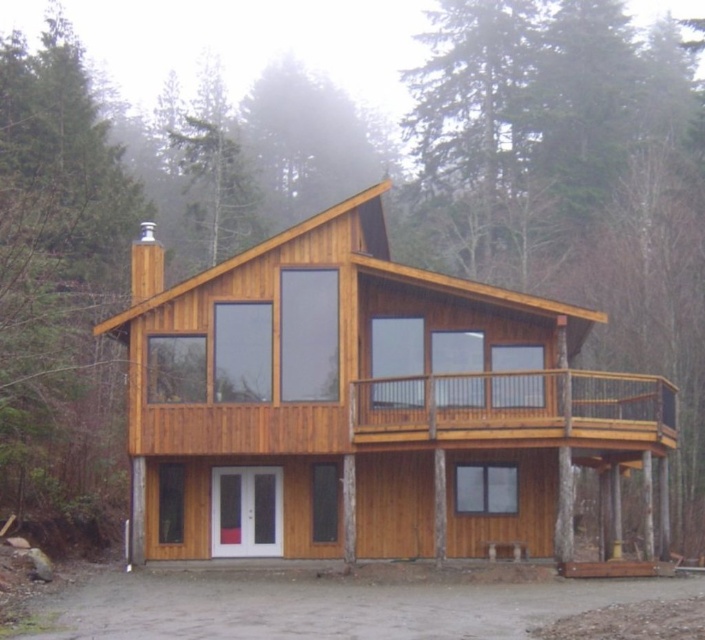
Question: Can you confirm if natural wood log cabin at center is positioned to the right of gray concrete driveway at lower center?

Choices:
 (A) yes
 (B) no

Answer: (A)

Question: Considering the real-world distances, which object is closest to the gray concrete driveway at lower center?

Choices:
 (A) wooden deck at center
 (B) natural wood log cabin at center

Answer: (B)

Question: Which point is closer to the camera?

Choices:
 (A) (570, 433)
 (B) (164, 602)

Answer: (B)

Question: Considering the relative positions of natural wood log cabin at center and wooden deck at center in the image provided, where is natural wood log cabin at center located with respect to wooden deck at center?

Choices:
 (A) below
 (B) above

Answer: (B)

Question: Which object appears closest to the camera in this image?

Choices:
 (A) wooden deck at center
 (B) natural wood log cabin at center
 (C) gray concrete driveway at lower center

Answer: (C)

Question: Can you confirm if gray concrete driveway at lower center is positioned below wooden deck at center?

Choices:
 (A) yes
 (B) no

Answer: (A)